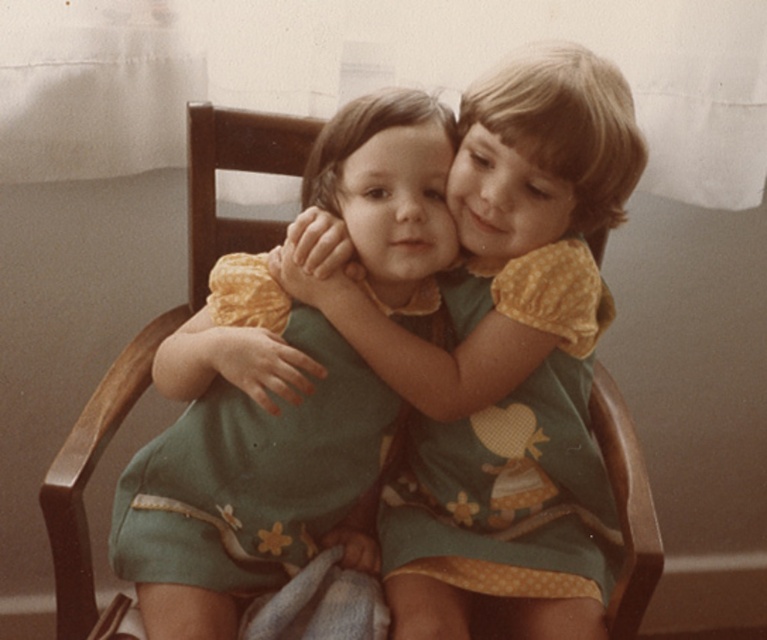
Is green fabric dress at center positioned at the back of green dotted dress at center?

That is False.

Who is shorter, green fabric dress at center or green dotted dress at center?

With less height is green dotted dress at center.

Is point (160, 474) closer to viewer compared to point (400, 492)?

That is True.

Where is `green fabric dress at center`? This screenshot has height=640, width=767. green fabric dress at center is located at coordinates (249, 460).

Is matte green dress at center to the right of green fabric dress at center from the viewer's perspective?

Indeed, matte green dress at center is positioned on the right side of green fabric dress at center.

Is point (438, 634) positioned before point (328, 541)?

Yes, it is in front of point (328, 541).

Locate an element on the screen. matte green dress at center is located at coordinates (507, 360).

Is point (532, 108) closer to camera compared to point (591, 301)?

Yes, point (532, 108) is in front of point (591, 301).

Where is `matte green dress at center`? The image size is (767, 640). matte green dress at center is located at coordinates (507, 360).